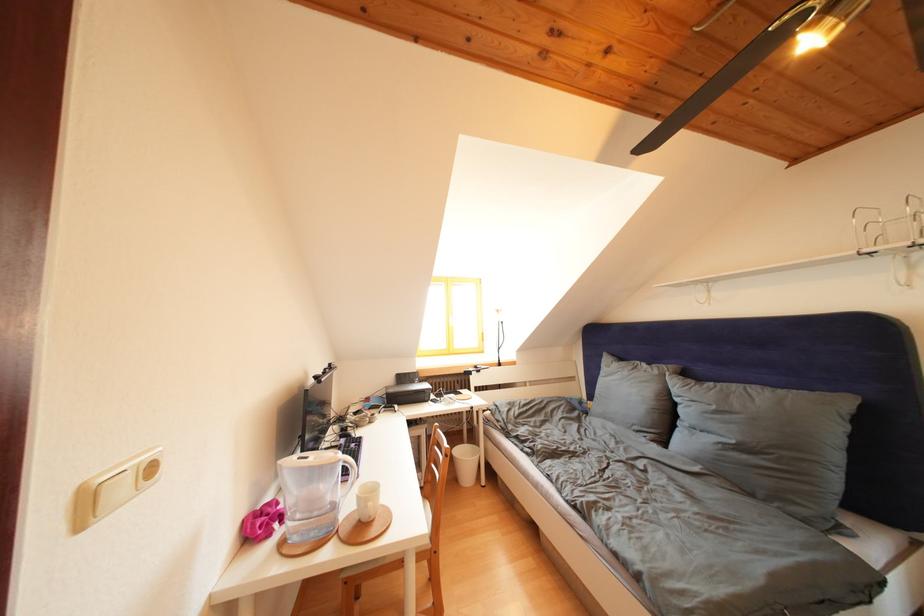
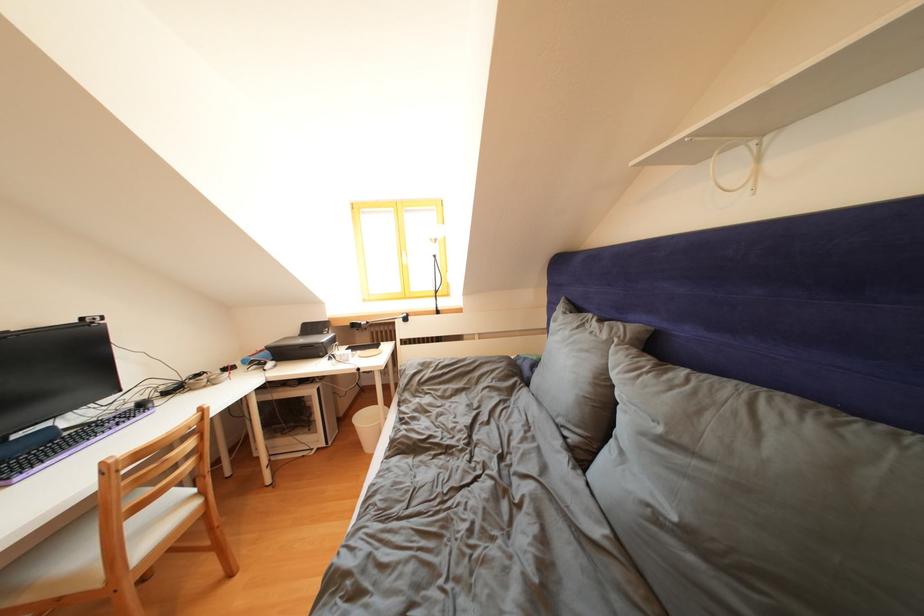
The images are taken continuously from a first-person perspective. In which direction are you moving?

The movement direction of the cameraman is right, forward.